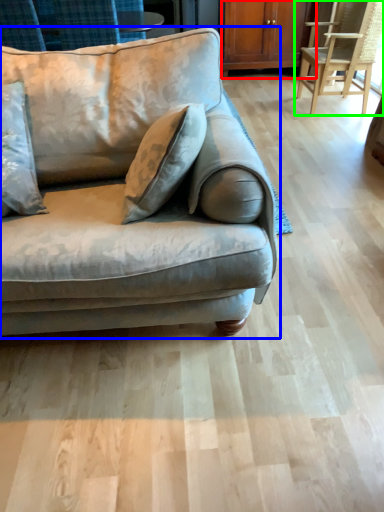
Question: Based on their relative distances, which object is farther from dresser (highlighted by a red box)? Choose from studio couch (highlighted by a blue box) and chair (highlighted by a green box).

Choices:
 (A) studio couch
 (B) chair

Answer: (A)